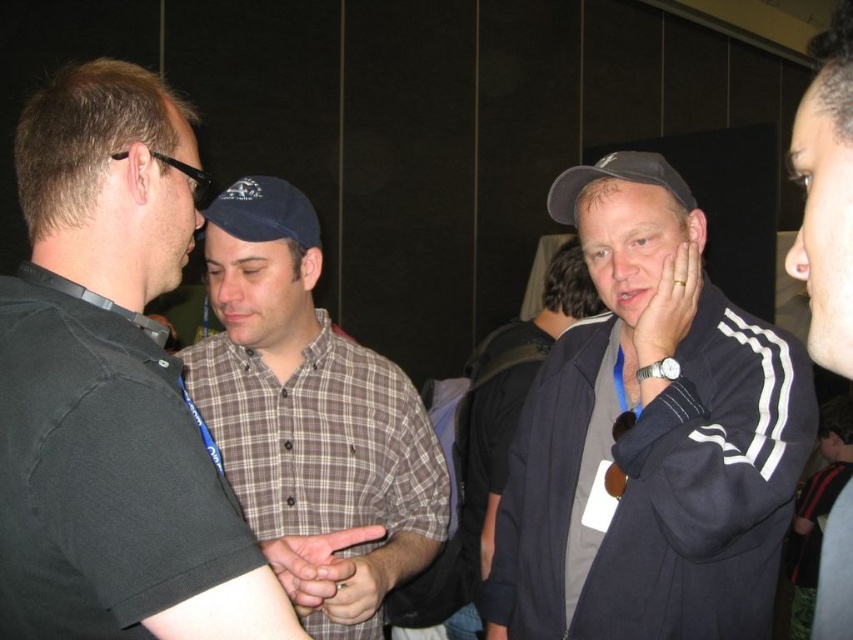
Describe the element at coordinates (310, 406) in the screenshot. I see `brown plaid shirt at center` at that location.

Can you confirm if brown plaid shirt at center is positioned below dark blue jacket at center?

No, brown plaid shirt at center is not below dark blue jacket at center.

This screenshot has height=640, width=853. Describe the element at coordinates (310, 406) in the screenshot. I see `brown plaid shirt at center` at that location.

At what (x,y) coordinates should I click in order to perform the action: click on brown plaid shirt at center. Please return your answer as a coordinate pair (x, y). The width and height of the screenshot is (853, 640). Looking at the image, I should click on (310, 406).

Image resolution: width=853 pixels, height=640 pixels. What do you see at coordinates (113, 388) in the screenshot? I see `black shirt at left` at bounding box center [113, 388].

Is black shirt at left thinner than dark blue track jacket at center?

Correct, black shirt at left's width is less than dark blue track jacket at center's.

What do you see at coordinates (113, 388) in the screenshot? I see `black shirt at left` at bounding box center [113, 388].

Identify the location of black shirt at left. (113, 388).

In the scene shown: Can you confirm if brown plaid shirt at center is positioned to the right of blue fabric baseball cap at center?

Yes, brown plaid shirt at center is to the right of blue fabric baseball cap at center.

Between point (402, 497) and point (268, 212), which one is positioned in front?

Point (268, 212)

The height and width of the screenshot is (640, 853). What are the coordinates of `brown plaid shirt at center` in the screenshot? It's located at (310, 406).